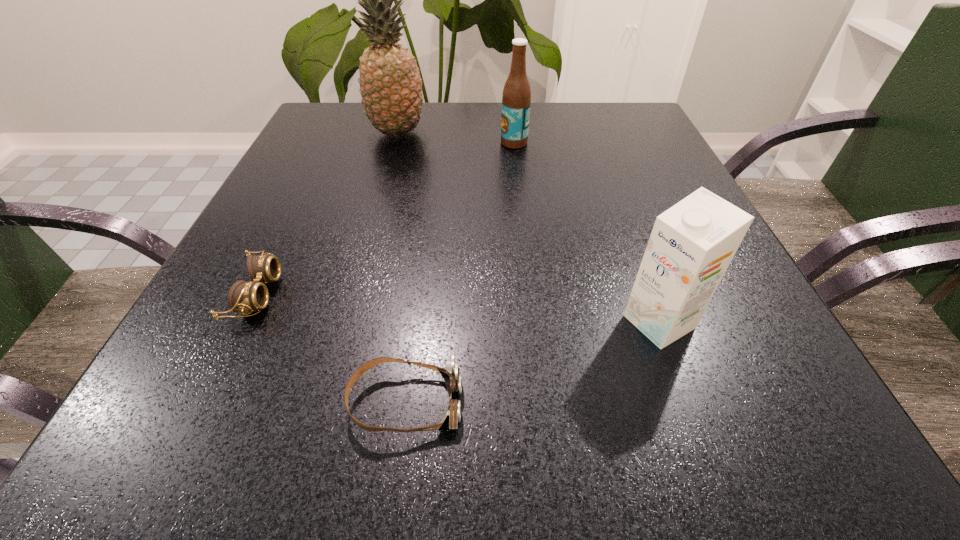
Where is `pineapple`? The image size is (960, 540). pineapple is located at coordinates (390, 84).

Where is `the second object from right to left`? The width and height of the screenshot is (960, 540). the second object from right to left is located at coordinates (516, 99).

You are a GUI agent. You are given a task and a screenshot of the screen. Output one action in this format:
    pyautogui.click(x=<x>, y=<y>)
    Task: Click on the rightmost object
    The image size is (960, 540).
    Given the screenshot: What is the action you would take?
    pyautogui.click(x=692, y=243)

The height and width of the screenshot is (540, 960). I want to click on the left goggles, so click(x=243, y=296).

Where is `the farther goggles`? the farther goggles is located at coordinates (243, 296).

Locate an element on the screen. the nearer goggles is located at coordinates (451, 375).

Where is `the nearest object`? the nearest object is located at coordinates (451, 375).

The height and width of the screenshot is (540, 960). I want to click on vacant position located 0.260m on the right of the pineapple, so click(x=536, y=133).

What are the coordinates of `free spot located on the left of the second object from right to left` in the screenshot? It's located at (379, 143).

You are a GUI agent. You are given a task and a screenshot of the screen. Output one action in this format:
    pyautogui.click(x=<x>, y=<y>)
    Task: Click on the free region located on the front of the carton
    The height and width of the screenshot is (540, 960).
    Given the screenshot: What is the action you would take?
    pyautogui.click(x=700, y=433)